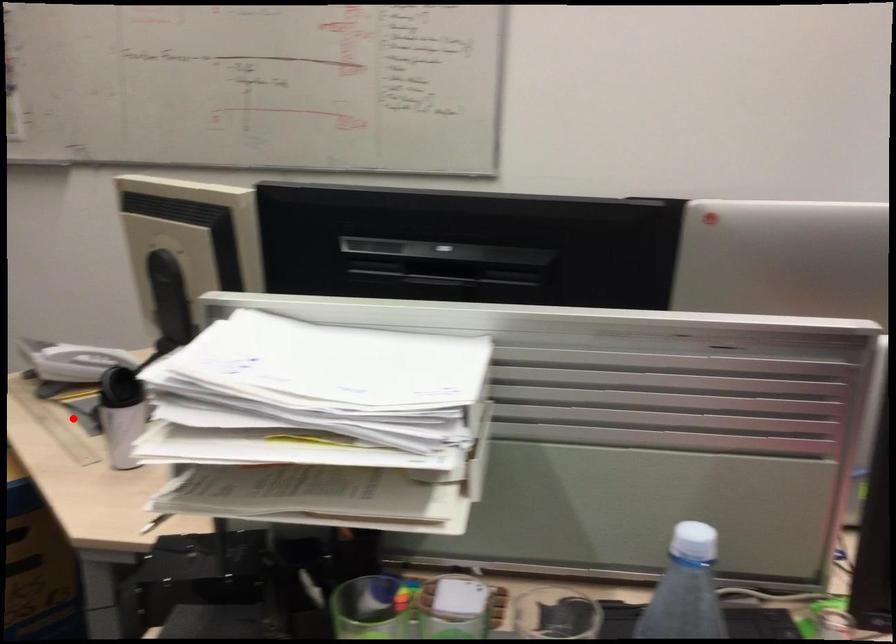
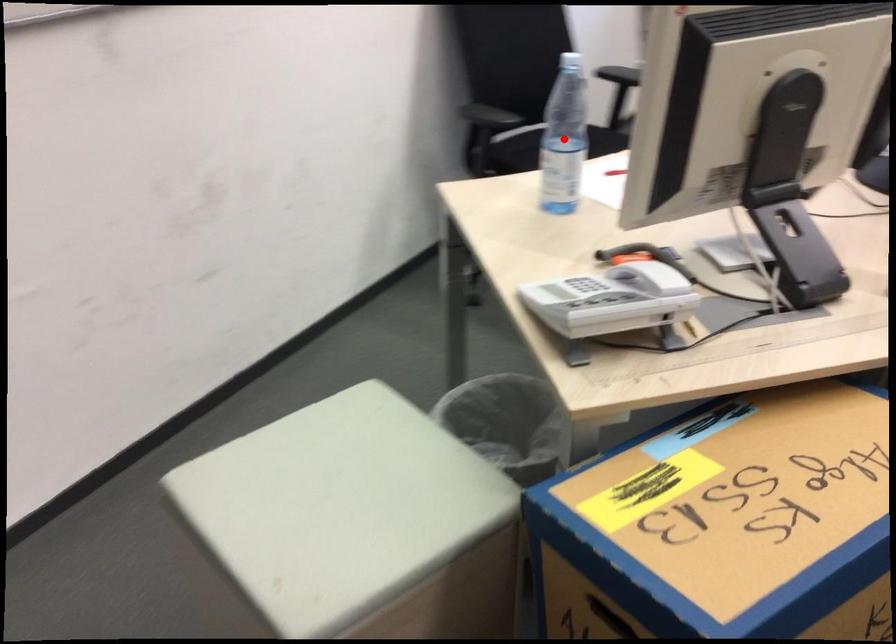
I am providing you with two images of the same scene from different viewpoints. A red point is marked on the first image and another point is marked on the second image. Does the point marked in image1 correspond to the same location as the one in image2?

No